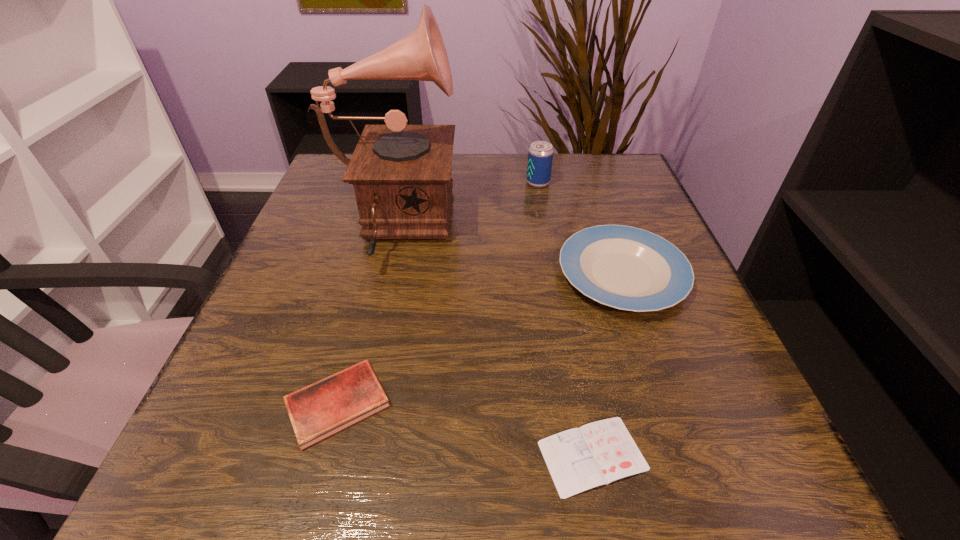
You are a GUI agent. You are given a task and a screenshot of the screen. Output one action in this format:
    pyautogui.click(x=<x>, y=<y>)
    Task: Click on the vacant area at the near edge
    This screenshot has width=960, height=540.
    Given the screenshot: What is the action you would take?
    pyautogui.click(x=412, y=438)

Find the location of a particular element. vacant region at the left edge of the desktop is located at coordinates (264, 413).

What are the coordinates of `vacant area at the right edge of the desktop` in the screenshot? It's located at click(700, 343).

Locate an element on the screen. This screenshot has height=540, width=960. free space at the far right corner of the desktop is located at coordinates (584, 181).

Image resolution: width=960 pixels, height=540 pixels. Identify the location of vacant region at the near right corner of the desktop. (684, 497).

Locate an element on the screen. The height and width of the screenshot is (540, 960). blank region between the plate and the left diary is located at coordinates (480, 339).

Find the location of a particular element. The image size is (960, 540). free space between the beer can and the second shortest object is located at coordinates (438, 293).

Locate an element on the screen. vacant space in between the left diary and the second tallest object is located at coordinates (438, 293).

At what (x,y) coordinates should I click in order to perform the action: click on vacant region between the third tallest object and the left diary. Please return your answer as a coordinate pair (x, y). The width and height of the screenshot is (960, 540). Looking at the image, I should click on (480, 339).

Find the location of `free spot between the left diary and the plate`. free spot between the left diary and the plate is located at coordinates (480, 339).